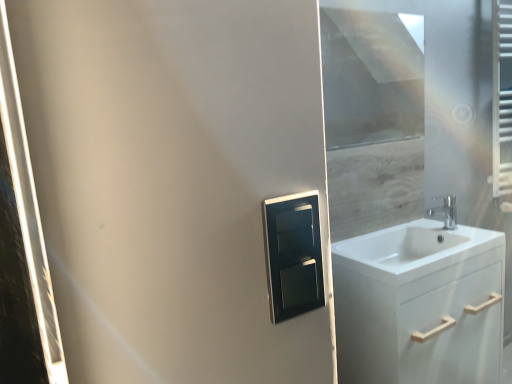
Question: From the image's perspective, is white glossy sink at right above chrome metallic faucet at right?

Choices:
 (A) no
 (B) yes

Answer: (A)

Question: Can you confirm if white glossy sink at right is thinner than chrome metallic faucet at right?

Choices:
 (A) no
 (B) yes

Answer: (A)

Question: From a real-world perspective, is white glossy sink at right located beneath chrome metallic faucet at right?

Choices:
 (A) no
 (B) yes

Answer: (B)

Question: From a real-world perspective, does white glossy sink at right stand above chrome metallic faucet at right?

Choices:
 (A) yes
 (B) no

Answer: (B)

Question: Can you confirm if white glossy sink at right is bigger than chrome metallic faucet at right?

Choices:
 (A) no
 (B) yes

Answer: (B)

Question: From a real-world perspective, relative to white glossy sink at right, is chrome metallic faucet at right vertically above or below?

Choices:
 (A) below
 (B) above

Answer: (B)

Question: Considering the relative positions of chrome metallic faucet at right and white glossy sink at right in the image provided, is chrome metallic faucet at right to the left or to the right of white glossy sink at right?

Choices:
 (A) left
 (B) right

Answer: (B)

Question: Is chrome metallic faucet at right wider or thinner than white glossy sink at right?

Choices:
 (A) thin
 (B) wide

Answer: (A)

Question: Relative to white glossy sink at right, is chrome metallic faucet at right in front or behind?

Choices:
 (A) behind
 (B) front

Answer: (A)

Question: In terms of height, does satin black medicine cabinet at center look taller or shorter compared to transparent glass window screen at upper right?

Choices:
 (A) tall
 (B) short

Answer: (B)

Question: Does point (271, 203) appear closer or farther from the camera than point (370, 125)?

Choices:
 (A) closer
 (B) farther

Answer: (A)

Question: Relative to transparent glass window screen at upper right, is satin black medicine cabinet at center in front or behind?

Choices:
 (A) behind
 (B) front

Answer: (B)

Question: From the image's perspective, is satin black medicine cabinet at center above or below transparent glass window screen at upper right?

Choices:
 (A) above
 (B) below

Answer: (B)

Question: In the image, is white glossy sink at right positioned in front of or behind chrome metallic faucet at right?

Choices:
 (A) front
 (B) behind

Answer: (A)

Question: Considering the positions of point (432, 259) and point (454, 223), is point (432, 259) closer or farther from the camera than point (454, 223)?

Choices:
 (A) closer
 (B) farther

Answer: (A)